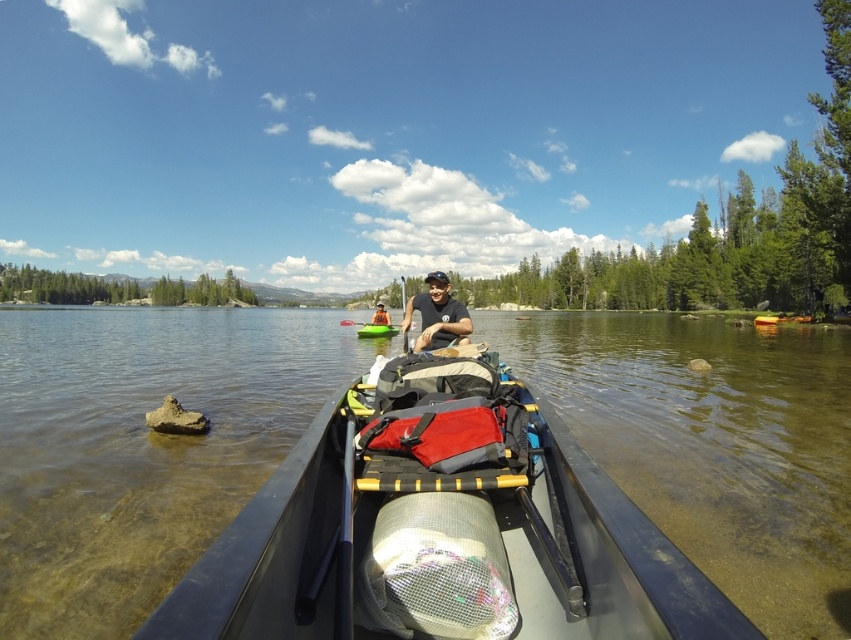
Question: Among these objects, which one is nearest to the camera?

Choices:
 (A) white plastic paddle at center
 (B) orange life vest at center
 (C) green plastic paddle at center
 (D) matte black kayak at center

Answer: (D)

Question: Does green plastic canoe at center have a lesser width compared to white plastic paddle at center?

Choices:
 (A) no
 (B) yes

Answer: (A)

Question: Considering the real-world distances, which object is closest to the green plastic canoe at center?

Choices:
 (A) black plastic canoe at center
 (B) matte black kayak at center
 (C) green plastic paddle at center
 (D) orange life vest at center

Answer: (D)

Question: Which point is closer to the camera?

Choices:
 (A) (357, 323)
 (B) (366, 326)
 (C) (350, 605)
 (D) (401, 291)

Answer: (C)

Question: Does green plastic canoe at center have a lesser width compared to orange life vest at center?

Choices:
 (A) yes
 (B) no

Answer: (B)

Question: Considering the relative positions of green plastic canoe at center and white plastic paddle at center in the image provided, where is green plastic canoe at center located with respect to white plastic paddle at center?

Choices:
 (A) right
 (B) left

Answer: (B)